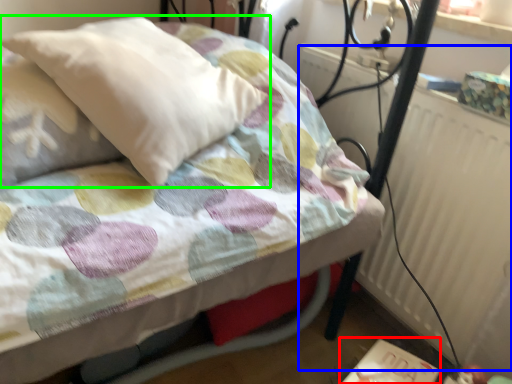
Question: Which object is the farthest from table (highlighted by a red box)? Choose among these: radiator (highlighted by a blue box) or pillow (highlighted by a green box).

Choices:
 (A) radiator
 (B) pillow

Answer: (B)